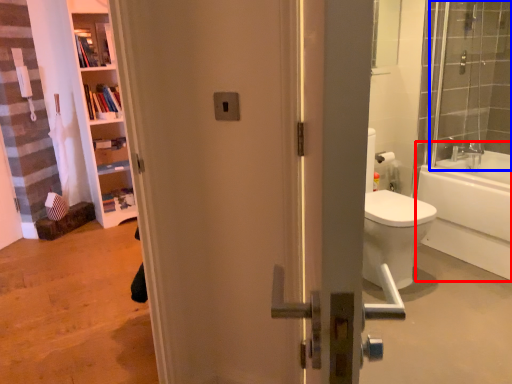
Question: Which object appears farthest to the camera in this image, bathtub (highlighted by a red box) or shower door (highlighted by a blue box)?

Choices:
 (A) bathtub
 (B) shower door

Answer: (A)